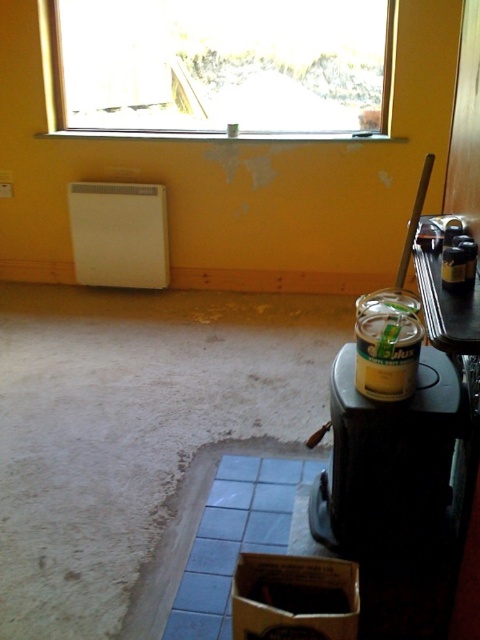
Is point (196, 97) farther from camera compared to point (387, 534)?

That is True.

Is point (143, 8) less distant than point (399, 547)?

No, (143, 8) is further to viewer.

At what (x,y) coordinates should I click in order to perform the action: click on transparent glass window at upper center. Please return your answer as a coordinate pair (x, y). The width and height of the screenshot is (480, 640). Looking at the image, I should click on (223, 67).